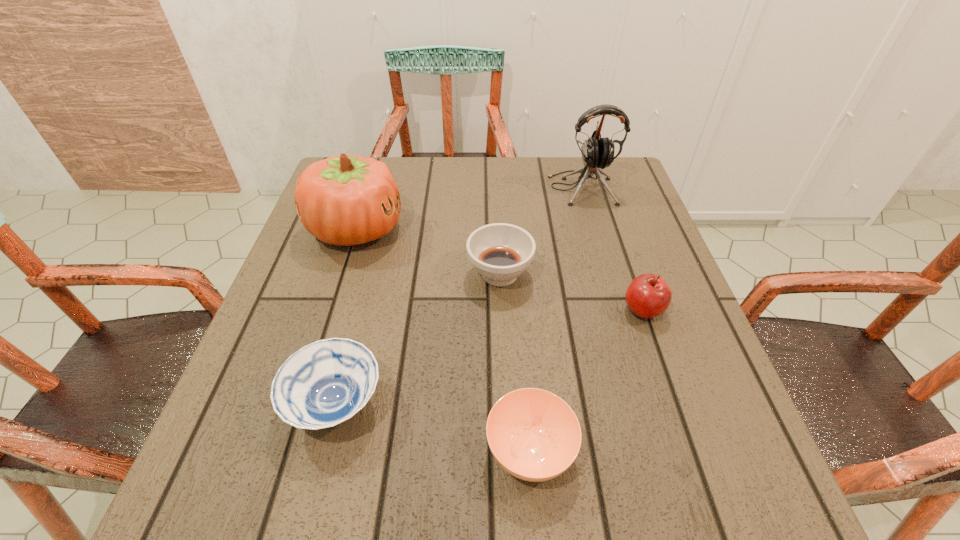
This screenshot has width=960, height=540. Find the location of `unoccupied area between the earphone and the leftmost soup bowl`. unoccupied area between the earphone and the leftmost soup bowl is located at coordinates (459, 296).

This screenshot has width=960, height=540. What are the coordinates of `free spot between the apple and the farthest soup bowl` in the screenshot? It's located at (571, 292).

Where is `vacant area between the leftmost soup bowl and the apple`? vacant area between the leftmost soup bowl and the apple is located at coordinates (490, 357).

The width and height of the screenshot is (960, 540). I want to click on free spot between the apple and the leftmost soup bowl, so click(x=490, y=357).

You are a GUI agent. You are given a task and a screenshot of the screen. Output one action in this format:
    pyautogui.click(x=<x>, y=<y>)
    Task: Click on the third closest object to the farthest soup bowl
    This screenshot has width=960, height=540.
    Given the screenshot: What is the action you would take?
    pyautogui.click(x=597, y=152)

Select which object appears as the closest to the leftmost soup bowl. Please provide its 2D coordinates. Your answer should be formatted as a tuple, i.e. [(x, y)], where the tuple contains the x and y coordinates of a point satisfying the conditions above.

[(534, 435)]

You are a GUI agent. You are given a task and a screenshot of the screen. Output one action in this format:
    pyautogui.click(x=<x>, y=<y>)
    Task: Click on the second closest soup bowl to the leftmost soup bowl
    The width and height of the screenshot is (960, 540).
    Given the screenshot: What is the action you would take?
    pyautogui.click(x=500, y=252)

Where is `soup bowl that stands as the second closest to the fifth shortest object`? soup bowl that stands as the second closest to the fifth shortest object is located at coordinates (325, 383).

Where is `vacant space that satisfies the following two spatial constraints: 1. on the front side of the earphone; 2. on the side of the second tallest object with the cute face`? vacant space that satisfies the following two spatial constraints: 1. on the front side of the earphone; 2. on the side of the second tallest object with the cute face is located at coordinates (593, 229).

I want to click on vacant area that satisfies the following two spatial constraints: 1. on the side of the pumpkin with the cute face; 2. on the back side of the leftmost soup bowl, so click(x=301, y=404).